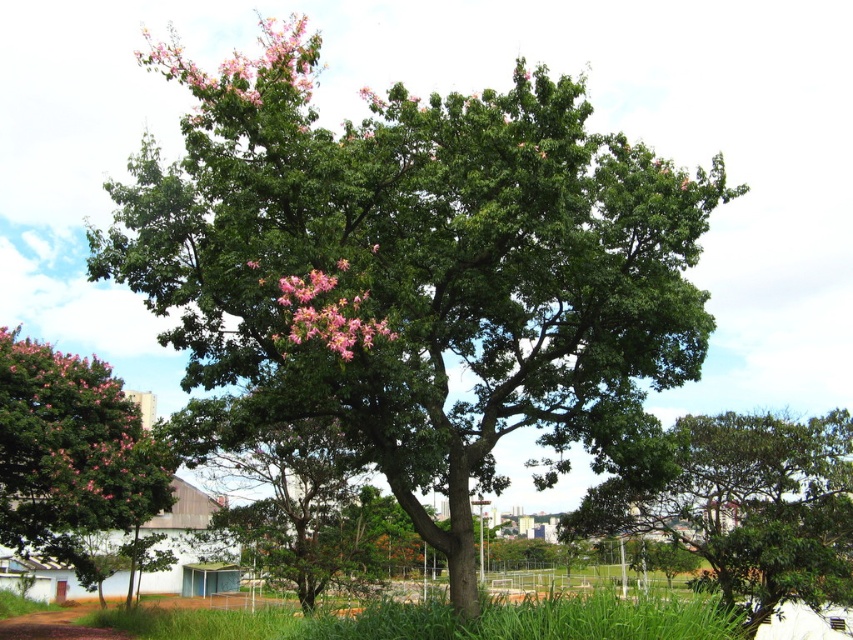
You are an urban planner designing a new park. You have a limited space of 3 meters in width. You need to place both the pink glossy tree at left and the pink matte flowers at upper left in this space. Which object should you place first to ensure both fit?

The pink glossy tree at left has a larger width than the pink matte flowers at upper left. Therefore, you should place the pink glossy tree at left first to accommodate its larger size, then fit the pink matte flowers at upper left in the remaining space.

You are standing in a park and want to take a photo of the green glossy tree at center. The park has a coordinate system where the bottom left corner is the origin. The point you are standing at is at coordinate point (x=734, y=500). Can you directly see the green glossy tree at center from your current position?

The green glossy tree at center is located at point (x=734, y=500), which is your current position. Therefore, you are already at the location of the green glossy tree at center and cannot see it from your current position.